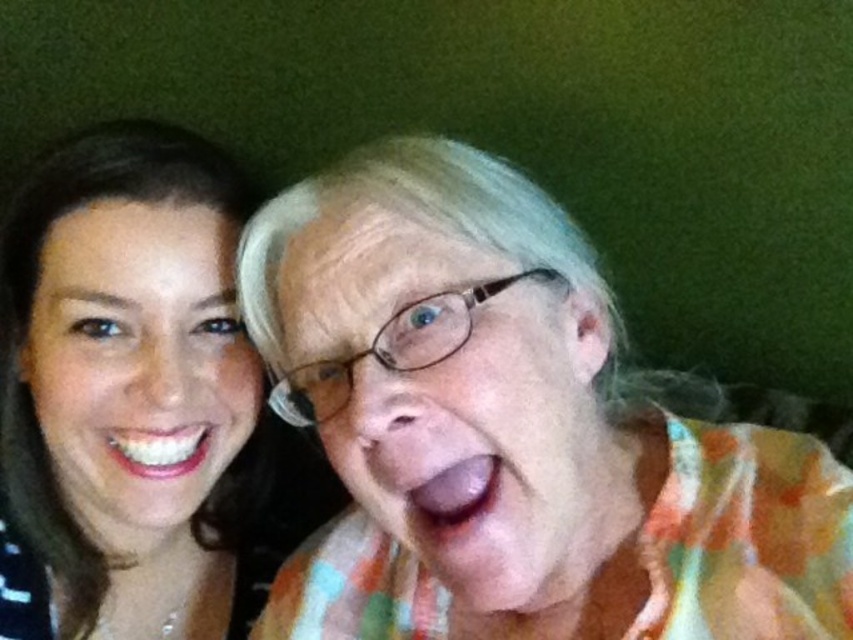
Does multicolored fabric at center appear on the left side of multicolored floral shirt at upper right?

No, multicolored fabric at center is not to the left of multicolored floral shirt at upper right.

Is point (506, 502) farther from camera compared to point (207, 220)?

That is False.

At what (x,y) coordinates should I click in order to perform the action: click on multicolored fabric at center. Please return your answer as a coordinate pair (x, y). Looking at the image, I should click on (514, 428).

Can you confirm if multicolored floral shirt at upper right is thinner than matte floral shirt at center?

Incorrect, multicolored floral shirt at upper right's width is not less than matte floral shirt at center's.

Who is higher up, multicolored floral shirt at upper right or matte floral shirt at center?

matte floral shirt at center

The height and width of the screenshot is (640, 853). Describe the element at coordinates (134, 396) in the screenshot. I see `multicolored floral shirt at upper right` at that location.

This screenshot has height=640, width=853. Find the location of `multicolored floral shirt at upper right`. multicolored floral shirt at upper right is located at coordinates (134, 396).

Is matte floral shirt at center positioned behind matte skin face at left?

No.

Which is in front, point (322, 426) or point (200, 211)?

Positioned in front is point (322, 426).

The width and height of the screenshot is (853, 640). Identify the location of matte floral shirt at center. (450, 401).